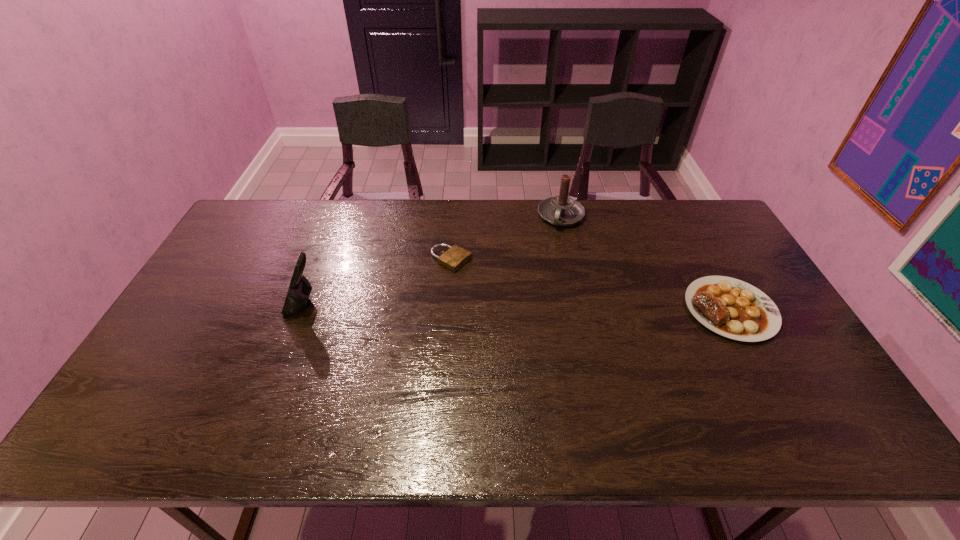
You are a GUI agent. You are given a task and a screenshot of the screen. Output one action in this format:
    pyautogui.click(x=<x>, y=<y>)
    Task: Click on the cellular telephone
    The width and height of the screenshot is (960, 540).
    Given the screenshot: What is the action you would take?
    pyautogui.click(x=299, y=291)

Find the location of a particular element. The height and width of the screenshot is (540, 960). the rightmost object is located at coordinates (732, 308).

Locate an element on the screen. This screenshot has width=960, height=540. the second shortest object is located at coordinates (732, 308).

Identify the location of candle. This screenshot has width=960, height=540. (561, 210).

This screenshot has width=960, height=540. I want to click on the third object from left to right, so click(561, 210).

This screenshot has width=960, height=540. I want to click on the shortest object, so click(x=455, y=257).

Where is `the second farthest object`? The width and height of the screenshot is (960, 540). the second farthest object is located at coordinates (455, 257).

The width and height of the screenshot is (960, 540). In order to click on vacant space located 0.070m on the front-facing side of the leftmost object in this screenshot , I will do `click(262, 305)`.

You are a GUI agent. You are given a task and a screenshot of the screen. Output one action in this format:
    pyautogui.click(x=<x>, y=<y>)
    Task: Click on the free space located 0.190m on the front-facing side of the leftmost object
    The height and width of the screenshot is (540, 960).
    Given the screenshot: What is the action you would take?
    pyautogui.click(x=221, y=305)

Where is `vacant space situated 0.140m on the front-facing side of the leftmost object`? vacant space situated 0.140m on the front-facing side of the leftmost object is located at coordinates (238, 305).